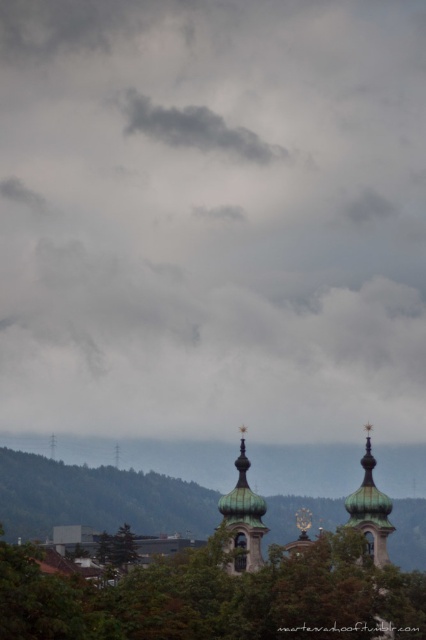
You are an architect analyzing the image. You need to determine which object occupies more visual space in the composition. Based on the scene, which is larger between the cloudy gray sky at upper center and the copper dome at center?

The cloudy gray sky at upper center is larger in size than the copper dome at center, so it occupies more visual space in the composition.

You are standing in a field looking at the scene described. There is a point marked at coordinates point (213, 218). Based on the scene description, what is the color of the area where this point is located?

The point (213, 218) is on cloudy gray sky at upper center, so the color is cloudy gray.